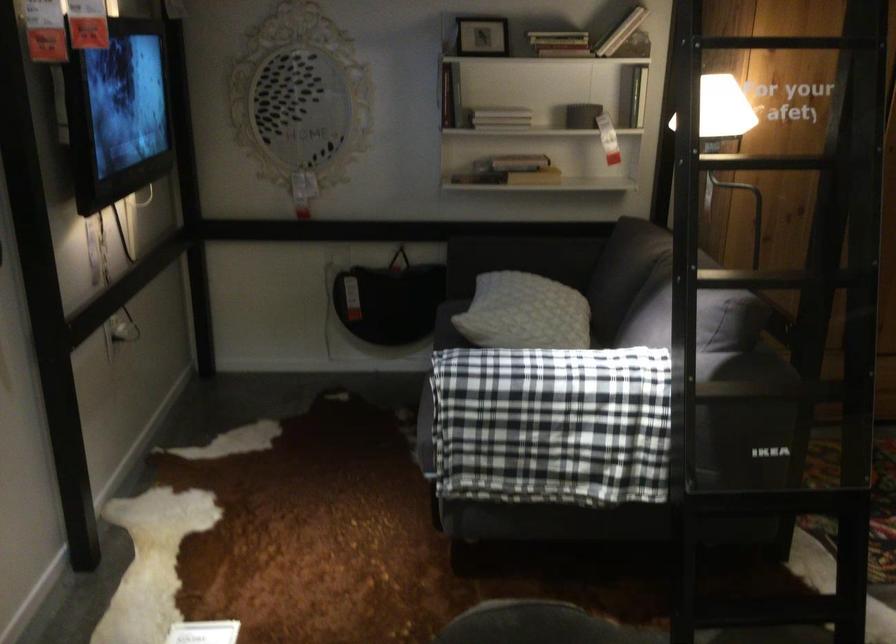
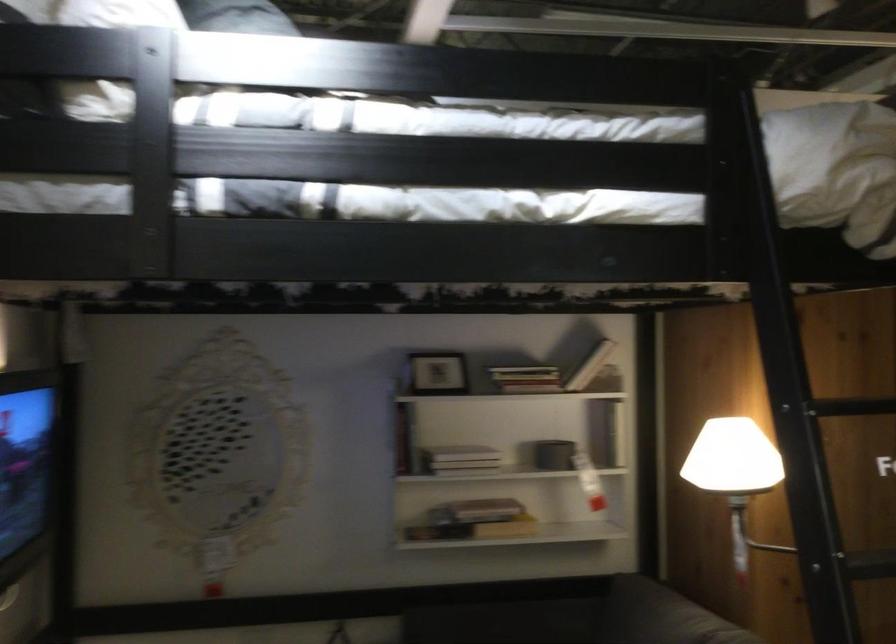
Locate, in the second image, the point that corresponds to point 576,102 in the first image.

(553, 453)